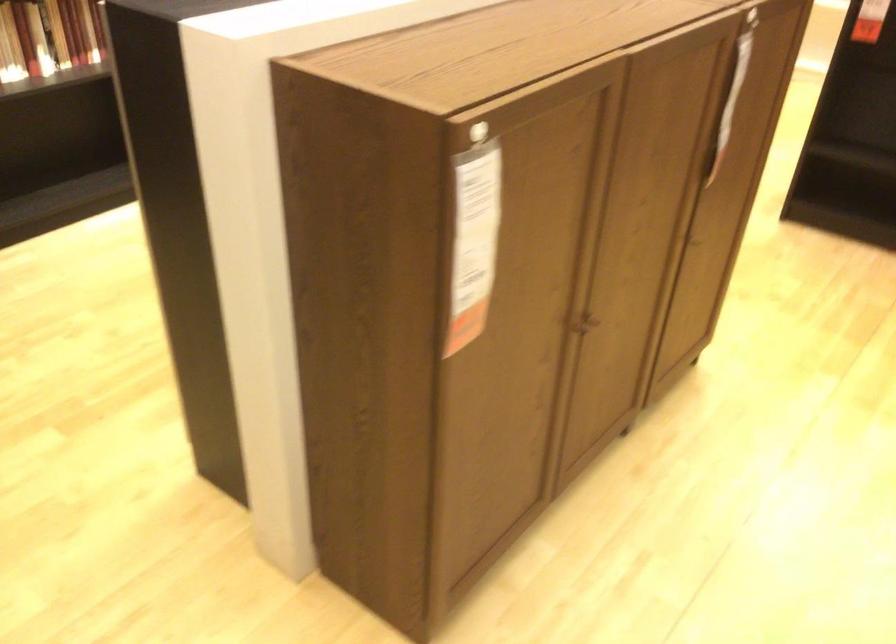
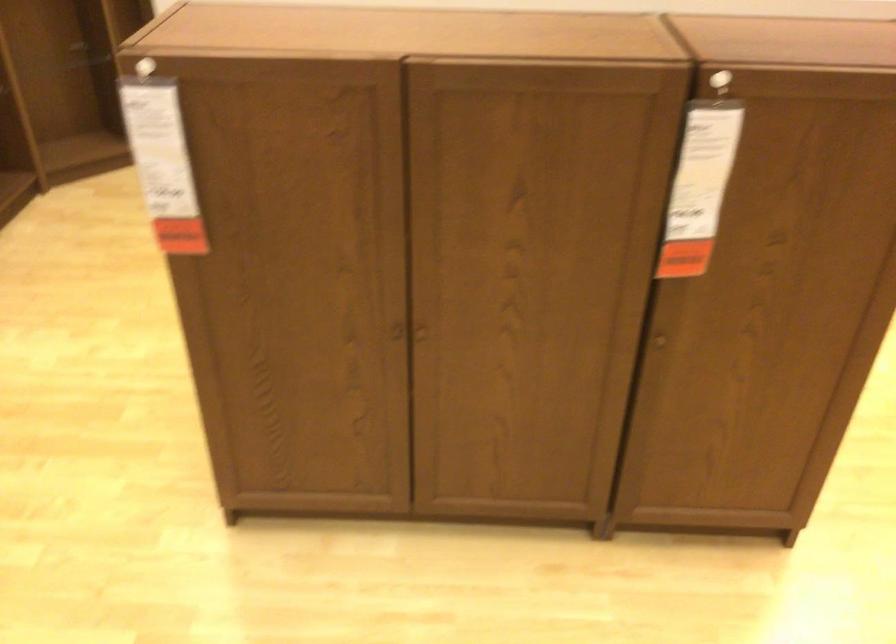
Where in the second image is the point corresponding to the point at 467,257 from the first image?

(162, 164)